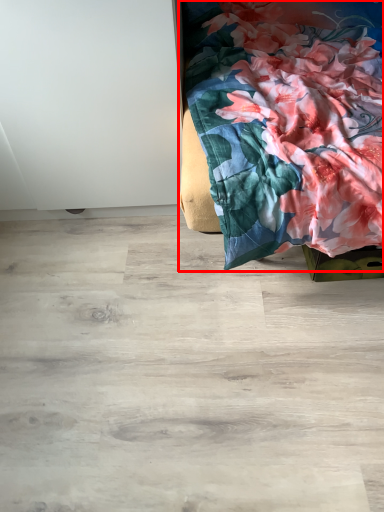
Question: From the image's perspective, what is the correct spatial positioning of furniture (annotated by the red box) in reference to plywood?

Choices:
 (A) below
 (B) above

Answer: (B)